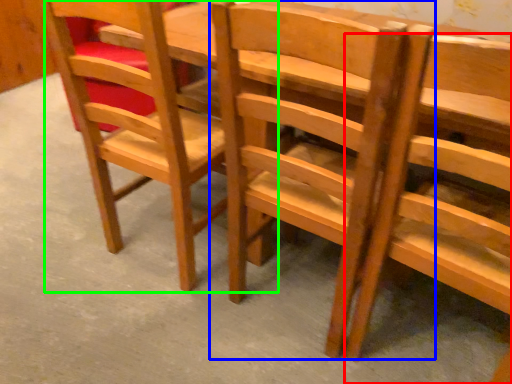
Question: Based on their relative distances, which object is farther from chair (highlighted by a red box)? Choose from chair (highlighted by a blue box) and chair (highlighted by a green box).

Choices:
 (A) chair
 (B) chair

Answer: (B)